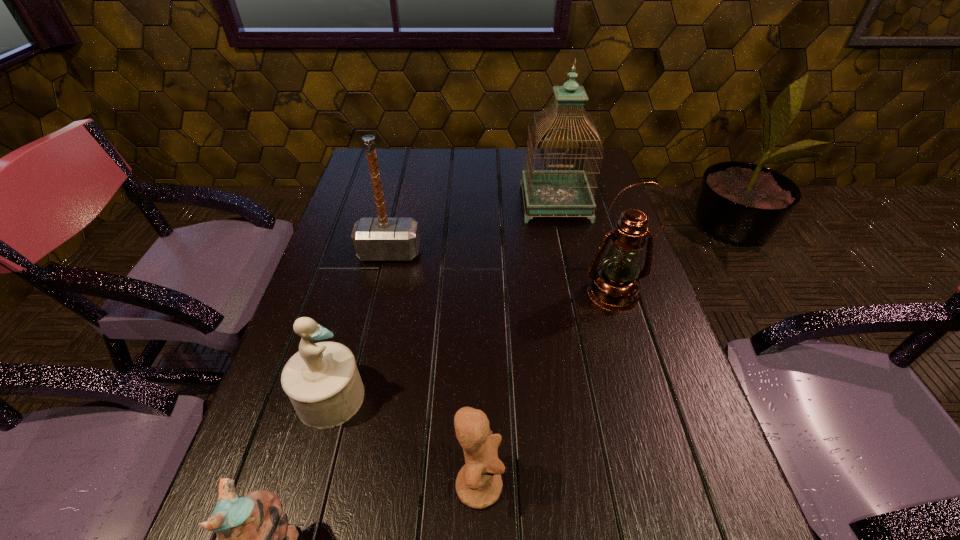
Choose which object is the second nearest neighbor to the nearest object. Please provide its 2D coordinates. Your answer should be formatted as a tuple, i.e. [(x, y)], where the tuple contains the x and y coordinates of a point satisfying the conditions above.

[(479, 484)]

Select which figurine appears as the second closest to the oil lamp. Please provide its 2D coordinates. Your answer should be formatted as a tuple, i.e. [(x, y)], where the tuple contains the x and y coordinates of a point satisfying the conditions above.

[(322, 381)]

Identify the location of figurine that is the second closest to the birdcage. The image size is (960, 540). (479, 484).

You are a GUI agent. You are given a task and a screenshot of the screen. Output one action in this format:
    pyautogui.click(x=<x>, y=<y>)
    Task: Click on the free space that satisfies the following two spatial constraints: 1. on the striking surface of the hammer; 2. on the left side of the third farthest object
    The width and height of the screenshot is (960, 540).
    Given the screenshot: What is the action you would take?
    pyautogui.click(x=380, y=293)

Find the location of a particular element. free space that satisfies the following two spatial constraints: 1. at the door of the farthest object; 2. at the beak of the farthest figurine is located at coordinates (596, 397).

At what (x,y) coordinates should I click in order to perform the action: click on vacant point that satisfies the following two spatial constraints: 1. at the door of the birdcage; 2. on the front-facing side of the second nearest figurine. Please return your answer as a coordinate pair (x, y). The height and width of the screenshot is (540, 960). Looking at the image, I should click on (615, 484).

Where is `free space that satisfies the following two spatial constraints: 1. on the front side of the oil lamp; 2. at the beak of the farthest figurine`? free space that satisfies the following two spatial constraints: 1. on the front side of the oil lamp; 2. at the beak of the farthest figurine is located at coordinates (644, 397).